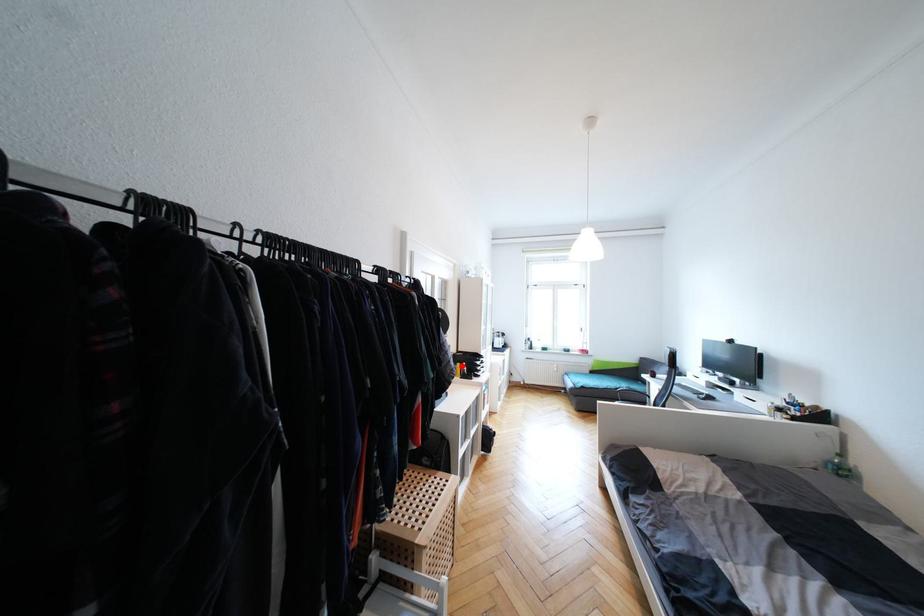
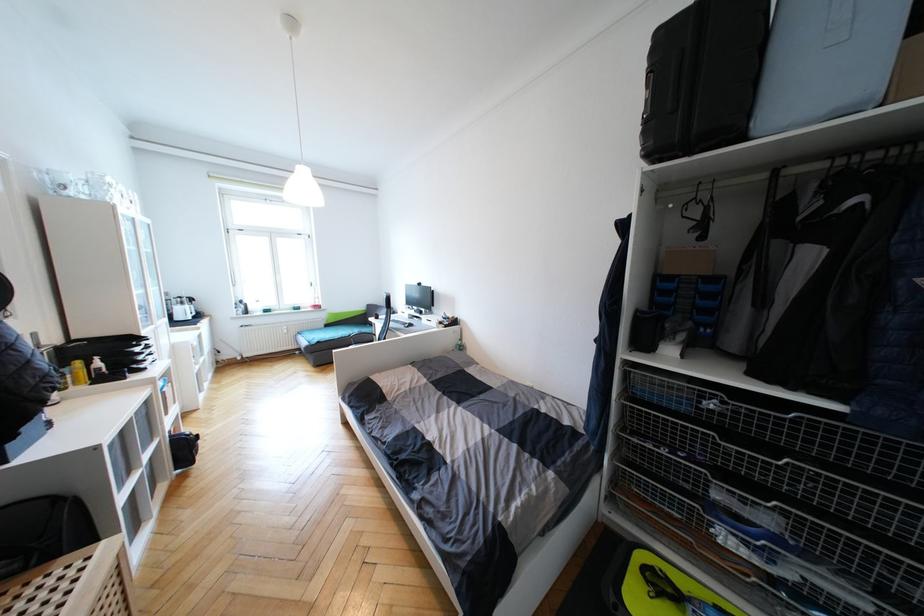
Question: I am providing you with two images of the same scene from different viewpoints. A red point is shown in image1. For the corresponding object point in image2, is it positioned nearer or farther from the camera?

Choices:
 (A) Nearer
 (B) Farther

Answer: (B)